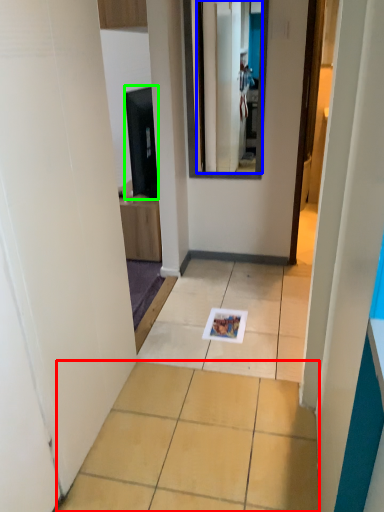
Question: Which is farther away from ceramic tile (highlighted by a red box)? mirror (highlighted by a blue box) or appliance (highlighted by a green box)?

Choices:
 (A) mirror
 (B) appliance

Answer: (A)